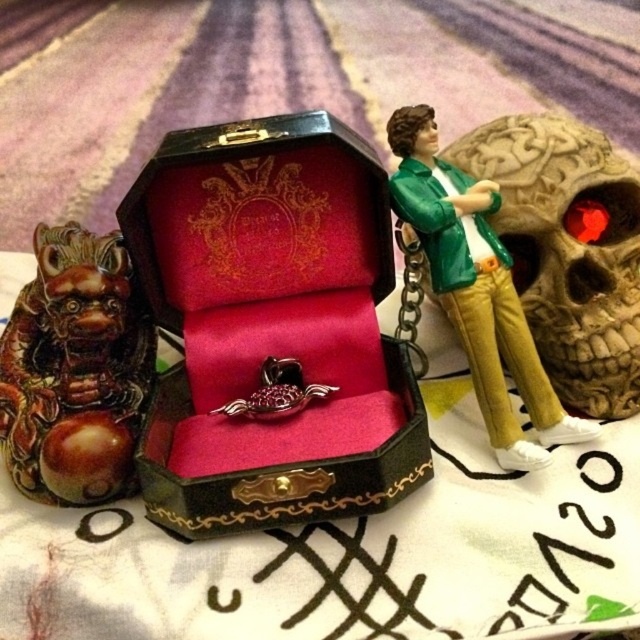
What do you see at coordinates (568, 250) in the screenshot? The height and width of the screenshot is (640, 640). I see `matte brown skull at right` at bounding box center [568, 250].

Between matte brown skull at right and metallic gold chain at center, which one has less height?

Standing shorter between the two is metallic gold chain at center.

What do you see at coordinates (568, 250) in the screenshot? I see `matte brown skull at right` at bounding box center [568, 250].

The height and width of the screenshot is (640, 640). Identify the location of matte brown skull at right. (568, 250).

Can you confirm if shiny brown statue at left is positioned to the right of metallic gold chain at center?

No, shiny brown statue at left is not to the right of metallic gold chain at center.

Does shiny brown statue at left have a greater height compared to metallic gold chain at center?

Indeed, shiny brown statue at left has a greater height compared to metallic gold chain at center.

You are a GUI agent. You are given a task and a screenshot of the screen. Output one action in this format:
    pyautogui.click(x=<x>, y=<y>)
    Task: Click on the shiny brown statue at left
    
    Given the screenshot: What is the action you would take?
    pyautogui.click(x=74, y=369)

The height and width of the screenshot is (640, 640). Describe the element at coordinates (272, 326) in the screenshot. I see `velvet-lined box at center` at that location.

Consider the image. Who is more distant from viewer, (289, 212) or (116, 289)?

The point (289, 212) is behind.

Find the location of `velvet-lined box at center`. velvet-lined box at center is located at coordinates (272, 326).